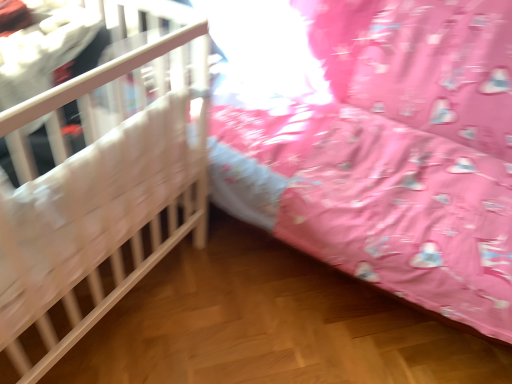
Question: Does point (10, 337) appear closer or farther from the camera than point (418, 244)?

Choices:
 (A) farther
 (B) closer

Answer: (B)

Question: From the image's perspective, is white wooden crib at left, positioned as the first infant bed in left-to-right order, located above or below wooden crib at left, which is the 2th infant bed from left to right?

Choices:
 (A) above
 (B) below

Answer: (B)

Question: In terms of width, does white wooden crib at left, positioned as the first infant bed in left-to-right order, look wider or thinner when compared to wooden crib at left, the 1th infant bed from the right?

Choices:
 (A) thin
 (B) wide

Answer: (A)

Question: In the image, is wooden crib at left, which is the 2th infant bed from left to right, positioned in front of or behind white wooden crib at left, positioned as the first infant bed in left-to-right order?

Choices:
 (A) front
 (B) behind

Answer: (B)

Question: From the image's perspective, relative to white wooden crib at left, positioned as the first infant bed in left-to-right order, is wooden crib at left, which is the 2th infant bed from left to right, above or below?

Choices:
 (A) below
 (B) above

Answer: (B)

Question: Is wooden crib at left, which is the 2th infant bed from left to right, spatially inside white wooden crib at left, which is the second infant bed from right to left, or outside of it?

Choices:
 (A) inside
 (B) outside

Answer: (B)

Question: From a real-world perspective, is wooden crib at left, the 1th infant bed from the right, positioned above or below white wooden crib at left, positioned as the first infant bed in left-to-right order?

Choices:
 (A) above
 (B) below

Answer: (A)